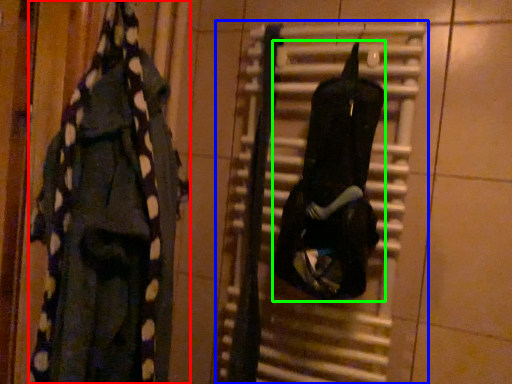
Question: Estimate the real-world distances between objects in this image. Which object is farther from clothing (highlighted by a red box), radiator (highlighted by a blue box) or clothing (highlighted by a green box)?

Choices:
 (A) radiator
 (B) clothing

Answer: (B)